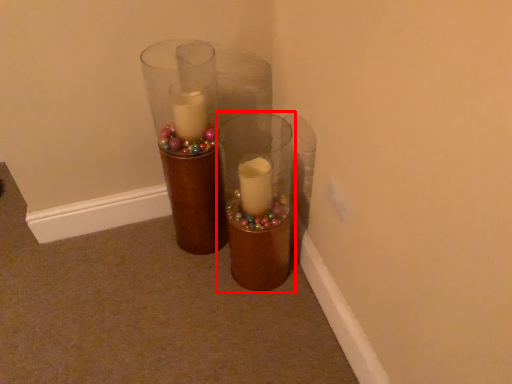
Question: In this image, where is vase (annotated by the red box) located relative to vase?

Choices:
 (A) right
 (B) left

Answer: (A)